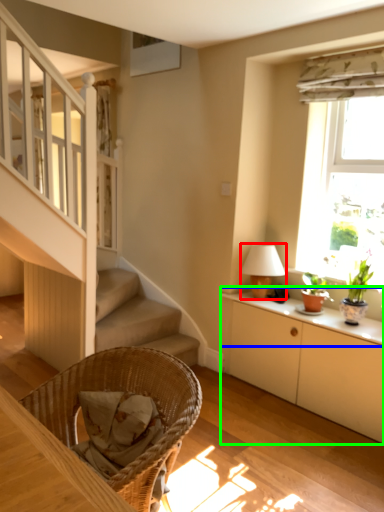
Question: Based on their relative distances, which object is nearer to table lamp (highlighted by a red box)? Choose from window sill (highlighted by a blue box) and cabinetry (highlighted by a green box).

Choices:
 (A) window sill
 (B) cabinetry

Answer: (A)